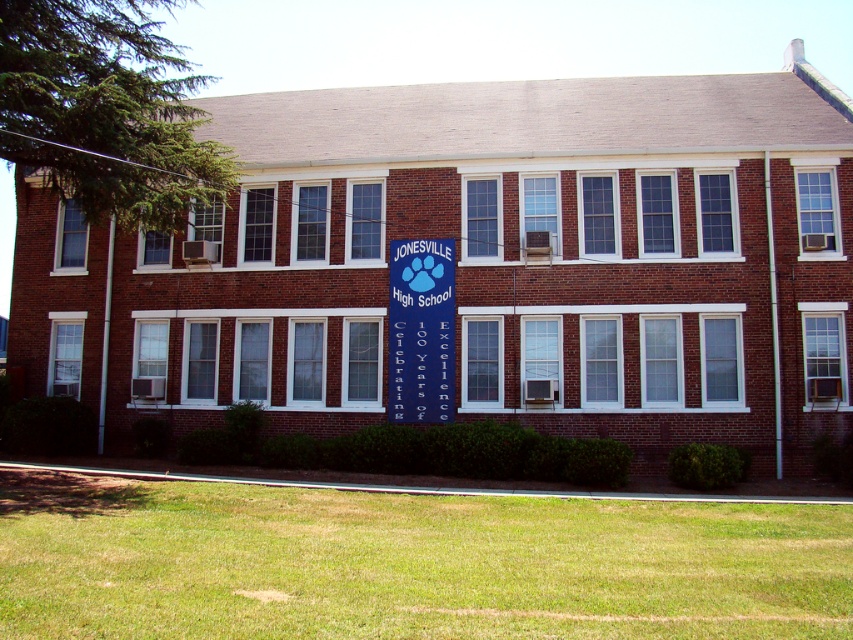
Which is below, green grass at lower center or blue fabric banner at center?

green grass at lower center is lower down.

Who is positioned more to the left, green grass at lower center or blue fabric banner at center?

green grass at lower center

Is point (361, 513) behind point (425, 419)?

No, (361, 513) is closer to viewer.

I want to click on green grass at lower center, so click(x=407, y=563).

Is brick building at center shorter than blue fabric banner at center?

In fact, brick building at center may be taller than blue fabric banner at center.

Is point (844, 392) in front of point (428, 282)?

Yes, point (844, 392) is in front of point (428, 282).

Image resolution: width=853 pixels, height=640 pixels. I want to click on brick building at center, so click(x=480, y=262).

Measure the distance between point (195, 412) and camera.

Point (195, 412) and camera are 21.74 meters apart from each other.

Consider the image. Is brick building at center to the left of green grass at lower center from the viewer's perspective?

No, brick building at center is not to the left of green grass at lower center.

Which is in front, point (67, 321) or point (821, 538)?

Positioned in front is point (821, 538).

The height and width of the screenshot is (640, 853). I want to click on brick building at center, so click(480, 262).